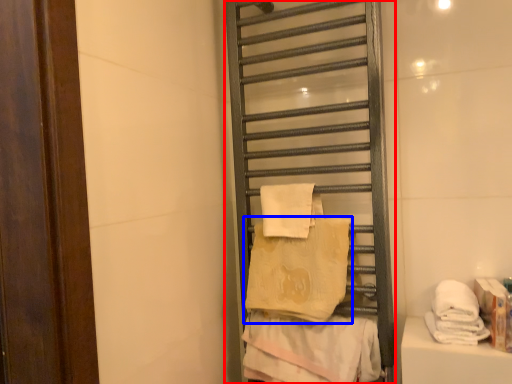
Question: Which point is further to the camera, shelf (highlighted by a red box) or towel (highlighted by a blue box)?

Choices:
 (A) shelf
 (B) towel

Answer: (B)